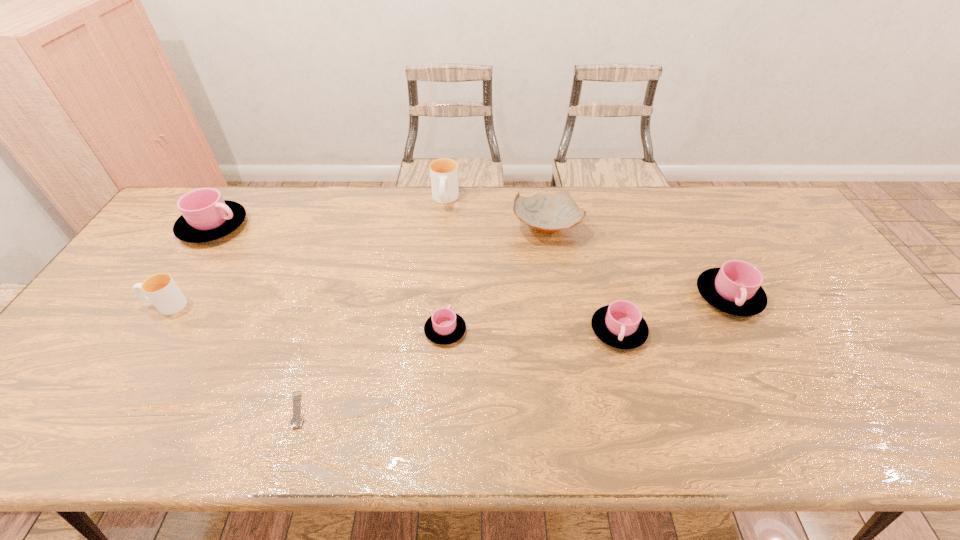
Image resolution: width=960 pixels, height=540 pixels. I want to click on free space located with the handle on the side of the nearer yellow cup, so click(99, 305).

Locate an element on the screen. The height and width of the screenshot is (540, 960). free region located 0.120m with the handle on the side of the nearer yellow cup is located at coordinates (102, 305).

Where is `vacant area located 0.190m on the side with the handle of the third shortest object`? vacant area located 0.190m on the side with the handle of the third shortest object is located at coordinates (644, 427).

Where is `free space located 0.270m on the side with the handle of the shortest cup`? free space located 0.270m on the side with the handle of the shortest cup is located at coordinates (451, 247).

What are the coordinates of `free spot located 0.260m on the side with the handle of the shortest cup` in the screenshot? It's located at (451, 249).

Find the location of a particular element. free space located 0.380m on the side with the handle of the shortest cup is located at coordinates (452, 224).

This screenshot has width=960, height=540. I want to click on free space located 0.060m on the right of the nearest object, so click(334, 409).

Image resolution: width=960 pixels, height=540 pixels. I want to click on pottery positioned at the far edge, so click(547, 213).

The width and height of the screenshot is (960, 540). I want to click on object that is positioned at the near edge, so click(x=296, y=421).

The width and height of the screenshot is (960, 540). I want to click on object at the far left corner, so click(x=206, y=216).